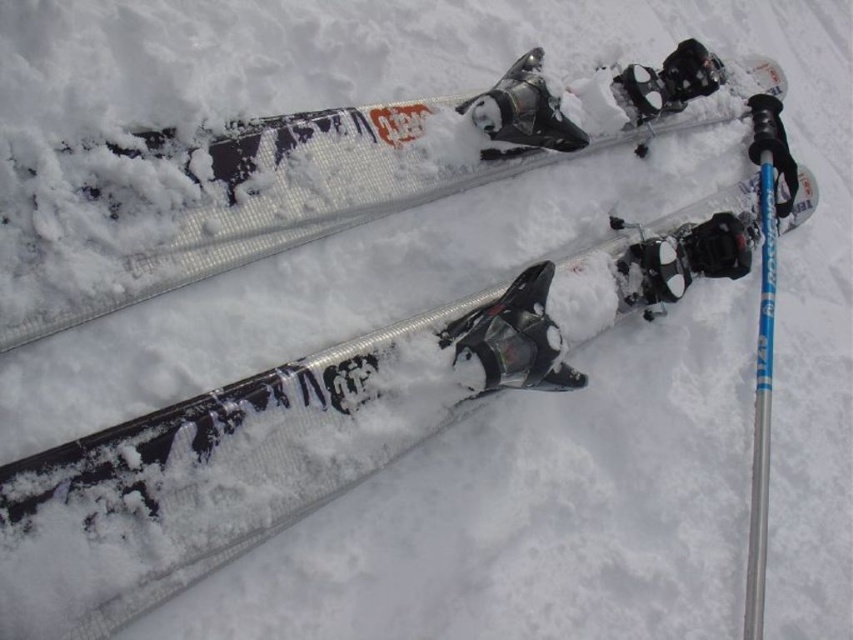
Does silver metallic skis at center have a smaller size compared to blue metallic pole at right?

Actually, silver metallic skis at center might be larger than blue metallic pole at right.

Is point (271, 145) behind point (749, 627)?

No, (271, 145) is in front of (749, 627).

You are a GUI agent. You are given a task and a screenshot of the screen. Output one action in this format:
    pyautogui.click(x=<x>, y=<y>)
    Task: Click on the silver metallic skis at center
    This screenshot has height=640, width=853.
    Given the screenshot: What is the action you would take?
    pyautogui.click(x=328, y=189)